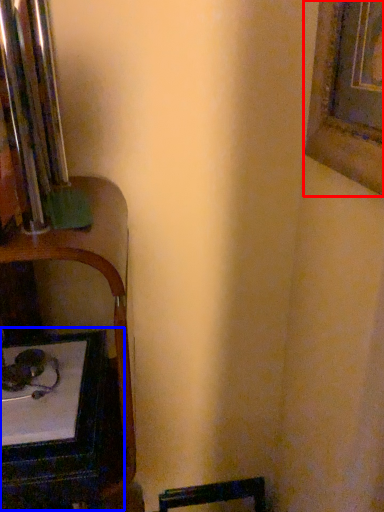
Question: Which object is further to the camera taking this photo, picture frame (highlighted by a red box) or table (highlighted by a blue box)?

Choices:
 (A) picture frame
 (B) table

Answer: (B)